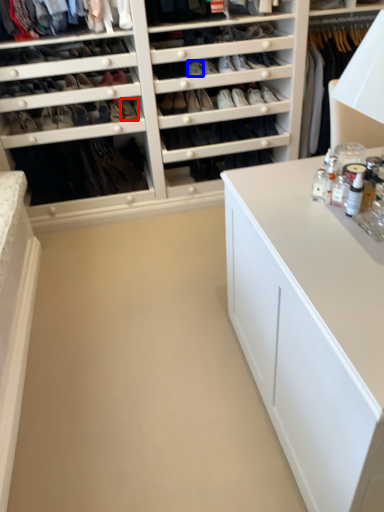
Question: Which object is further to the camera taking this photo, shoe (highlighted by a red box) or shoe (highlighted by a blue box)?

Choices:
 (A) shoe
 (B) shoe

Answer: (A)